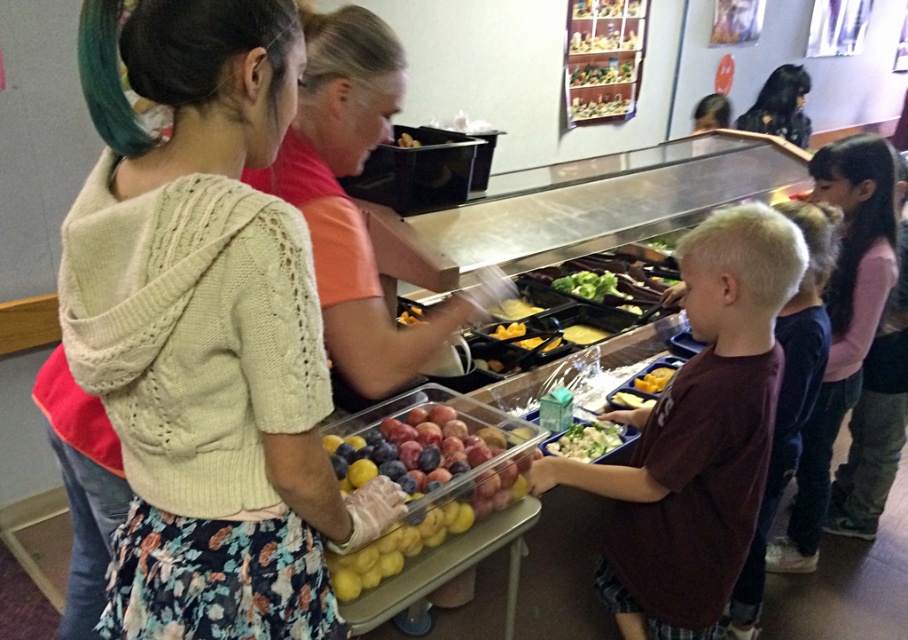
You are standing at the entrance of the cafeteria and see two points marked on the floor. The first point is labeled as point (709, 397) and the second is point (494, 310). Which point is closer to you?

Point (709, 397) is in front of point (494, 310), so it is closer to you.